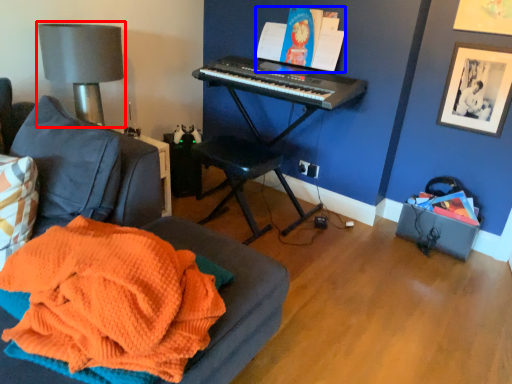
Question: Which object appears closest to the camera in this image, table lamp (highlighted by a red box) or book (highlighted by a blue box)?

Choices:
 (A) table lamp
 (B) book

Answer: (A)